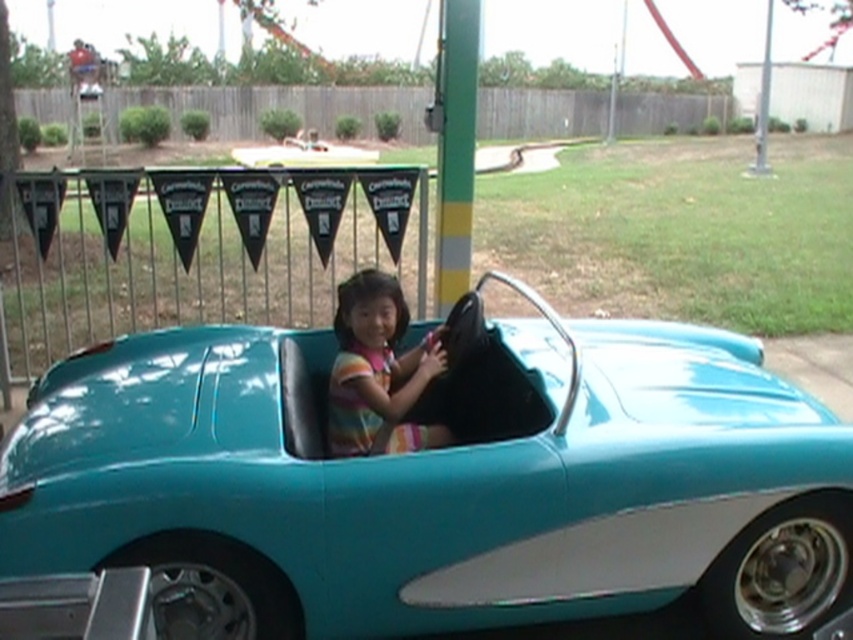
Question: Does teal glossy car at center have a larger size compared to striped fabric child at center?

Choices:
 (A) no
 (B) yes

Answer: (B)

Question: Among these points, which one is nearest to the camera?

Choices:
 (A) (x=286, y=552)
 (B) (x=415, y=387)

Answer: (A)

Question: Where is teal glossy car at center located in relation to striped fabric child at center in the image?

Choices:
 (A) left
 (B) right

Answer: (B)

Question: Which of the following is the closest to the observer?

Choices:
 (A) striped fabric child at center
 (B) teal glossy car at center

Answer: (B)

Question: Which point is farther to the camera?

Choices:
 (A) striped fabric child at center
 (B) teal glossy car at center

Answer: (A)

Question: Does teal glossy car at center appear over striped fabric child at center?

Choices:
 (A) no
 (B) yes

Answer: (A)